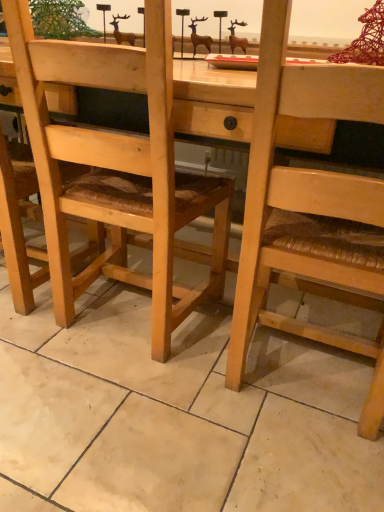
Question: Is natural wood chair at center, which is the first chair in right-to-left order, taller or shorter than wooden woven seat at center, which is the first chair from left to right?

Choices:
 (A) tall
 (B) short

Answer: (A)

Question: In the image, is natural wood chair at center, which is the second chair from left to right, positioned in front of or behind wooden woven seat at center, placed as the second chair when sorted from right to left?

Choices:
 (A) behind
 (B) front

Answer: (B)

Question: From a real-world perspective, is natural wood chair at center, which is the first chair in right-to-left order, physically located above or below wooden woven seat at center, which is the first chair from left to right?

Choices:
 (A) below
 (B) above

Answer: (B)

Question: From the image's perspective, relative to natural wood chair at center, which is the second chair from left to right, is wooden woven seat at center, which is the first chair from left to right, above or below?

Choices:
 (A) below
 (B) above

Answer: (B)

Question: From their relative heights in the image, would you say wooden woven seat at center, placed as the second chair when sorted from right to left, is taller or shorter than natural wood chair at center, which is the first chair in right-to-left order?

Choices:
 (A) tall
 (B) short

Answer: (B)

Question: Do you think wooden woven seat at center, placed as the second chair when sorted from right to left, is within natural wood chair at center, which is the second chair from left to right, or outside of it?

Choices:
 (A) inside
 (B) outside

Answer: (B)

Question: In the image, is wooden woven seat at center, placed as the second chair when sorted from right to left, positioned in front of or behind natural wood chair at center, which is the first chair in right-to-left order?

Choices:
 (A) front
 (B) behind

Answer: (B)